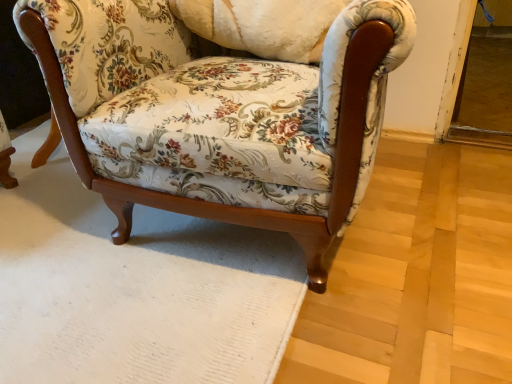
Locate an element on the screen. This screenshot has height=384, width=512. floral fabric chair at center is located at coordinates (219, 115).

This screenshot has height=384, width=512. What do you see at coordinates (219, 115) in the screenshot?
I see `floral fabric chair at center` at bounding box center [219, 115].

What do you see at coordinates (263, 25) in the screenshot?
I see `floral fabric pillow at center` at bounding box center [263, 25].

Where is `floral fabric pillow at center`? The height and width of the screenshot is (384, 512). floral fabric pillow at center is located at coordinates pyautogui.click(x=263, y=25).

The height and width of the screenshot is (384, 512). I want to click on floral fabric chair at center, so click(x=219, y=115).

Considering the relative positions of floral fabric chair at center and floral fabric pillow at center in the image provided, is floral fabric chair at center to the left of floral fabric pillow at center from the viewer's perspective?

No, floral fabric chair at center is not to the left of floral fabric pillow at center.

In the scene shown: Which object is further away from the camera taking this photo, floral fabric chair at center or floral fabric pillow at center?

floral fabric pillow at center is behind.

Which is closer to the camera, [136,123] or [298,55]?

The point [136,123] is closer to the camera.

From the image's perspective, does floral fabric chair at center appear lower than floral fabric pillow at center?

Yes, from the image's perspective, floral fabric chair at center is below floral fabric pillow at center.

From a real-world perspective, does floral fabric chair at center sit lower than floral fabric pillow at center?

Yes, from a real-world perspective, floral fabric chair at center is below floral fabric pillow at center.

Between floral fabric chair at center and floral fabric pillow at center, which one has smaller width?

floral fabric pillow at center.

Looking at this image, between floral fabric chair at center and floral fabric pillow at center, which one has less height?

With less height is floral fabric pillow at center.

In terms of size, does floral fabric chair at center appear bigger or smaller than floral fabric pillow at center?

In the image, floral fabric chair at center appears to be larger than floral fabric pillow at center.

Is floral fabric chair at center outside of floral fabric pillow at center?

Indeed, floral fabric chair at center is completely outside floral fabric pillow at center.

Are floral fabric chair at center and floral fabric pillow at center far apart?

No.

Is floral fabric chair at center positioned with its back to floral fabric pillow at center?

Correct, floral fabric chair at center is looking away from floral fabric pillow at center.

How different are the orientations of floral fabric chair at center and floral fabric pillow at center in degrees?

floral fabric chair at center and floral fabric pillow at center are facing 7.79 degrees away from each other.

Locate an element on the screen. pillow above the floral fabric chair at center (from the image's perspective) is located at coordinates (263, 25).

Visually, is floral fabric pillow at center positioned to the left or to the right of floral fabric chair at center?

Based on their positions, floral fabric pillow at center is located to the left of floral fabric chair at center.

Considering the positions of objects floral fabric pillow at center and floral fabric chair at center in the image provided, who is behind, floral fabric pillow at center or floral fabric chair at center?

Positioned behind is floral fabric pillow at center.

Between point (259, 21) and point (163, 35), which one is positioned behind?

The point (163, 35) is more distant.

From the image's perspective, which is above, floral fabric pillow at center or floral fabric chair at center?

From the image's view, floral fabric pillow at center is above.

From a real-world perspective, which is physically below, floral fabric pillow at center or floral fabric chair at center?

floral fabric chair at center, from a real-world perspective.

Considering the sizes of objects floral fabric pillow at center and floral fabric chair at center in the image provided, who is thinner, floral fabric pillow at center or floral fabric chair at center?

floral fabric pillow at center is thinner.

Can you confirm if floral fabric pillow at center is shorter than floral fabric chair at center?

Indeed, floral fabric pillow at center has a lesser height compared to floral fabric chair at center.

Between floral fabric pillow at center and floral fabric chair at center, which one has larger size?

floral fabric chair at center is bigger.

Is floral fabric chair at center located within floral fabric pillow at center?

No, floral fabric chair at center is not inside floral fabric pillow at center.

Is floral fabric pillow at center far away from floral fabric chair at center?

floral fabric pillow at center is near floral fabric chair at center, not far away.

Based on the photo, is floral fabric pillow at center facing away from floral fabric chair at center?

Yes, floral fabric pillow at center is positioned with its back facing floral fabric chair at center.

Identify the location of chair that is under the floral fabric pillow at center (from a real-world perspective). (219, 115).

I want to click on chair that appears below the floral fabric pillow at center (from the image's perspective), so click(x=219, y=115).

At what (x,y) coordinates should I click in order to perform the action: click on chair located in front of the floral fabric pillow at center. Please return your answer as a coordinate pair (x, y). The height and width of the screenshot is (384, 512). Looking at the image, I should click on (219, 115).